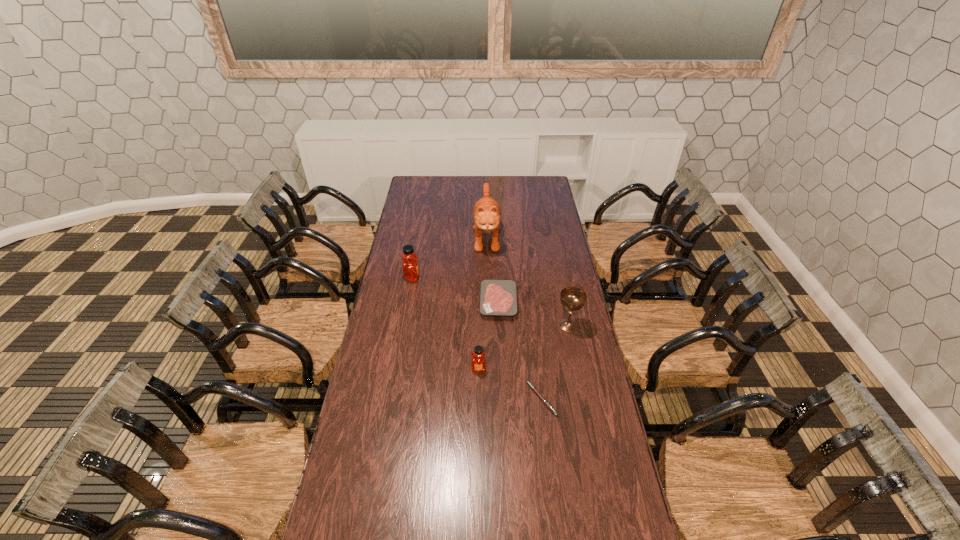
This screenshot has height=540, width=960. What are the coordinates of `blank space located on the front label of the taller honey` in the screenshot? It's located at 490,278.

Locate an element on the screen. This screenshot has width=960, height=540. free space located on the front label of the fourth tallest object is located at coordinates (478, 477).

Find the location of a particular element. The image size is (960, 540). vacant space situated on the left of the fifth tallest object is located at coordinates (406, 302).

You are a GUI agent. You are given a task and a screenshot of the screen. Output one action in this format:
    pyautogui.click(x=<x>, y=<y>)
    Task: Click on the free space located on the face of the tallest object
    Image resolution: width=960 pixels, height=540 pixels.
    Given the screenshot: What is the action you would take?
    pyautogui.click(x=488, y=309)

At what (x,y) coordinates should I click in order to perform the action: click on vacant area located at the nib of the pen. Please return your answer as a coordinate pair (x, y). Looking at the image, I should click on (492, 399).

Identify the location of vacant space located 0.310m at the nib of the pen. (443, 399).

Find the location of a particular element. free space located at the nib of the pen is located at coordinates click(x=490, y=399).

Locate an element on the screen. This screenshot has height=540, width=960. vacant space located 0.260m on the left of the chalice is located at coordinates (494, 325).

The height and width of the screenshot is (540, 960). I want to click on object positioned at the left edge, so click(410, 268).

You are a GUI agent. You are given a task and a screenshot of the screen. Output one action in this format:
    pyautogui.click(x=<x>, y=<y>)
    Task: Click on the object that is at the right edge
    Image resolution: width=960 pixels, height=540 pixels.
    Given the screenshot: What is the action you would take?
    pyautogui.click(x=572, y=298)